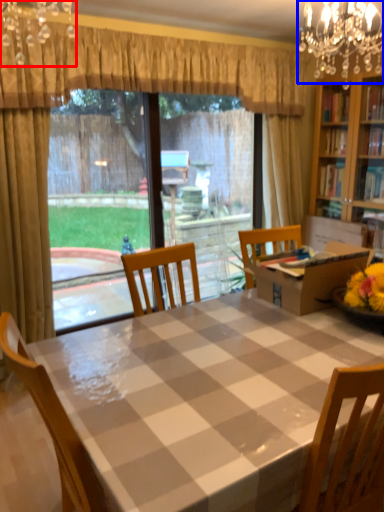
Question: Which object is closer to the camera taking this photo, light fixture (highlighted by a red box) or light fixture (highlighted by a blue box)?

Choices:
 (A) light fixture
 (B) light fixture

Answer: (A)